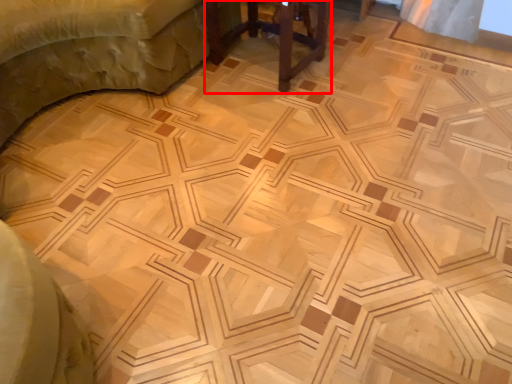
Question: From the image's perspective, where is furniture (annotated by the red box) located in relation to furniture in the image?

Choices:
 (A) below
 (B) above

Answer: (A)